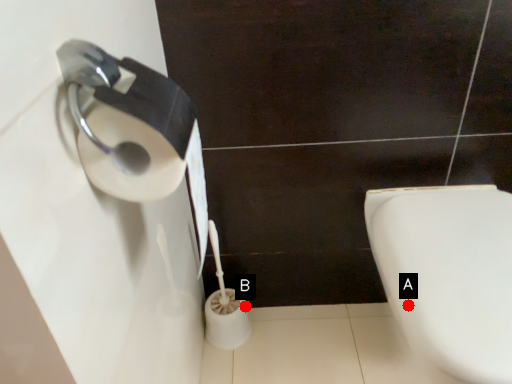
Question: Two points are circled on the image, labeled by A and B beside each circle. Which point is further to the camera?

Choices:
 (A) A is further
 (B) B is further

Answer: (B)